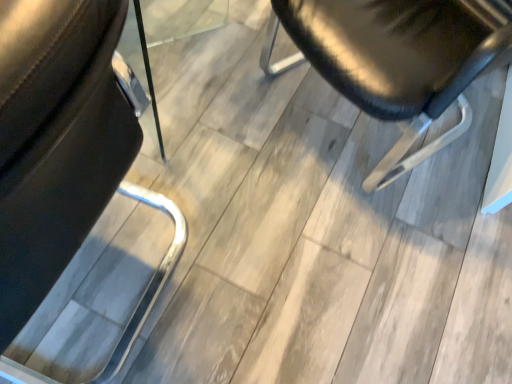
What is the approximate height of black leather chair at left, arranged as the second chair when viewed from the right?

36.14 inches.

Locate an element on the screen. black leather chair at left, arranged as the second chair when viewed from the right is located at coordinates (65, 155).

Describe the element at coordinates (65, 155) in the screenshot. I see `black leather chair at left, arranged as the second chair when viewed from the right` at that location.

What do you see at coordinates (395, 57) in the screenshot?
I see `shiny black chair at center, which appears as the first chair when viewed from the right` at bounding box center [395, 57].

Where is `shiny black chair at center, which appears as the first chair when viewed from the right`? The width and height of the screenshot is (512, 384). shiny black chair at center, which appears as the first chair when viewed from the right is located at coordinates (395, 57).

What is the approximate height of shiny black chair at center, which is counted as the second chair, starting from the left?

The height of shiny black chair at center, which is counted as the second chair, starting from the left, is 31.80 inches.

Where is `black leather chair at left, arranged as the second chair when viewed from the right`? The width and height of the screenshot is (512, 384). black leather chair at left, arranged as the second chair when viewed from the right is located at coordinates 65,155.

Considering the positions of objects shiny black chair at center, which appears as the first chair when viewed from the right, and black leather chair at left, arranged as the second chair when viewed from the right, in the image provided, who is more to the right, shiny black chair at center, which appears as the first chair when viewed from the right, or black leather chair at left, arranged as the second chair when viewed from the right,?

From the viewer's perspective, shiny black chair at center, which appears as the first chair when viewed from the right, appears more on the right side.

Is the depth of shiny black chair at center, which appears as the first chair when viewed from the right, less than that of black leather chair at left, placed as the 1th chair when sorted from left to right?

No, it is not.

Which point is more forward, (377, 109) or (16, 191)?

The point (16, 191) is closer to the camera.

From the image's perspective, is shiny black chair at center, which is counted as the second chair, starting from the left, under black leather chair at left, arranged as the second chair when viewed from the right?

Actually, shiny black chair at center, which is counted as the second chair, starting from the left, appears above black leather chair at left, arranged as the second chair when viewed from the right, in the image.

From a real-world perspective, is shiny black chair at center, which appears as the first chair when viewed from the right, physically above black leather chair at left, placed as the 1th chair when sorted from left to right?

No, from a real-world perspective, shiny black chair at center, which appears as the first chair when viewed from the right, is not on top of black leather chair at left, placed as the 1th chair when sorted from left to right.

Looking at their sizes, would you say shiny black chair at center, which is counted as the second chair, starting from the left, is wider or thinner than black leather chair at left, placed as the 1th chair when sorted from left to right?

shiny black chair at center, which is counted as the second chair, starting from the left, is wider than black leather chair at left, placed as the 1th chair when sorted from left to right.

Considering the sizes of objects shiny black chair at center, which appears as the first chair when viewed from the right, and black leather chair at left, arranged as the second chair when viewed from the right, in the image provided, who is taller, shiny black chair at center, which appears as the first chair when viewed from the right, or black leather chair at left, arranged as the second chair when viewed from the right,?

With more height is black leather chair at left, arranged as the second chair when viewed from the right.

Considering the sizes of objects shiny black chair at center, which is counted as the second chair, starting from the left, and black leather chair at left, arranged as the second chair when viewed from the right, in the image provided, who is bigger, shiny black chair at center, which is counted as the second chair, starting from the left, or black leather chair at left, arranged as the second chair when viewed from the right,?

black leather chair at left, arranged as the second chair when viewed from the right, is bigger.

Would you say shiny black chair at center, which is counted as the second chair, starting from the left, is outside black leather chair at left, arranged as the second chair when viewed from the right?

Yes, shiny black chair at center, which is counted as the second chair, starting from the left, is outside of black leather chair at left, arranged as the second chair when viewed from the right.

Is the surface of shiny black chair at center, which appears as the first chair when viewed from the right, in direct contact with black leather chair at left, placed as the 1th chair when sorted from left to right?

No, shiny black chair at center, which appears as the first chair when viewed from the right, is not beside black leather chair at left, placed as the 1th chair when sorted from left to right.

Is shiny black chair at center, which is counted as the second chair, starting from the left, oriented away from black leather chair at left, arranged as the second chair when viewed from the right?

No, black leather chair at left, arranged as the second chair when viewed from the right, is not at the back of shiny black chair at center, which is counted as the second chair, starting from the left.

Can you tell me how much shiny black chair at center, which is counted as the second chair, starting from the left, and black leather chair at left, placed as the 1th chair when sorted from left to right, differ in facing direction?

The angle between the facing direction of shiny black chair at center, which is counted as the second chair, starting from the left, and the facing direction of black leather chair at left, placed as the 1th chair when sorted from left to right, is 58.4 degrees.

Where is `chair that is behind the black leather chair at left, placed as the 1th chair when sorted from left to right`? chair that is behind the black leather chair at left, placed as the 1th chair when sorted from left to right is located at coordinates (395, 57).

Which object is positioned more to the left, black leather chair at left, placed as the 1th chair when sorted from left to right, or shiny black chair at center, which appears as the first chair when viewed from the right?

Positioned to the left is black leather chair at left, placed as the 1th chair when sorted from left to right.

Considering the positions of objects black leather chair at left, placed as the 1th chair when sorted from left to right, and shiny black chair at center, which appears as the first chair when viewed from the right, in the image provided, who is behind, black leather chair at left, placed as the 1th chair when sorted from left to right, or shiny black chair at center, which appears as the first chair when viewed from the right,?

shiny black chair at center, which appears as the first chair when viewed from the right, is further away from the camera.

Does point (0, 358) appear closer or farther from the camera than point (426, 58)?

Point (0, 358) is farther from the camera than point (426, 58).

From the image's perspective, does black leather chair at left, placed as the 1th chair when sorted from left to right, appear higher than shiny black chair at center, which is counted as the second chair, starting from the left?

Actually, black leather chair at left, placed as the 1th chair when sorted from left to right, appears below shiny black chair at center, which is counted as the second chair, starting from the left, in the image.

From a real-world perspective, relative to shiny black chair at center, which appears as the first chair when viewed from the right, is black leather chair at left, arranged as the second chair when viewed from the right, vertically above or below?

black leather chair at left, arranged as the second chair when viewed from the right, is situated higher than shiny black chair at center, which appears as the first chair when viewed from the right, in the real world.

Which of these two, black leather chair at left, arranged as the second chair when viewed from the right, or shiny black chair at center, which appears as the first chair when viewed from the right, is thinner?

black leather chair at left, arranged as the second chair when viewed from the right.

Is black leather chair at left, arranged as the second chair when viewed from the right, shorter than shiny black chair at center, which is counted as the second chair, starting from the left?

Incorrect, the height of black leather chair at left, arranged as the second chair when viewed from the right, does not fall short of that of shiny black chair at center, which is counted as the second chair, starting from the left.

Considering the relative sizes of black leather chair at left, arranged as the second chair when viewed from the right, and shiny black chair at center, which is counted as the second chair, starting from the left, in the image provided, is black leather chair at left, arranged as the second chair when viewed from the right, smaller than shiny black chair at center, which is counted as the second chair, starting from the left,?

Actually, black leather chair at left, arranged as the second chair when viewed from the right, might be larger than shiny black chair at center, which is counted as the second chair, starting from the left.

Can we say black leather chair at left, placed as the 1th chair when sorted from left to right, lies outside shiny black chair at center, which is counted as the second chair, starting from the left?

Indeed, black leather chair at left, placed as the 1th chair when sorted from left to right, is completely outside shiny black chair at center, which is counted as the second chair, starting from the left.

Would you say black leather chair at left, placed as the 1th chair when sorted from left to right, is a long distance from shiny black chair at center, which appears as the first chair when viewed from the right?

No.

Is black leather chair at left, arranged as the second chair when viewed from the right, aimed at shiny black chair at center, which is counted as the second chair, starting from the left?

No, black leather chair at left, arranged as the second chair when viewed from the right, is not oriented towards shiny black chair at center, which is counted as the second chair, starting from the left.

How far apart are black leather chair at left, arranged as the second chair when viewed from the right, and shiny black chair at center, which is counted as the second chair, starting from the left?

black leather chair at left, arranged as the second chair when viewed from the right, is 25.80 inches away from shiny black chair at center, which is counted as the second chair, starting from the left.

In the image, there is a shiny black chair at center, which is counted as the second chair, starting from the left. Where is `chair below it (from the image's perspective)`? Image resolution: width=512 pixels, height=384 pixels. chair below it (from the image's perspective) is located at coordinates [x=65, y=155].

The height and width of the screenshot is (384, 512). I want to click on chair behind the black leather chair at left, arranged as the second chair when viewed from the right, so click(x=395, y=57).

Where is `chair that is below the shiny black chair at center, which is counted as the second chair, starting from the left (from the image's perspective)`? chair that is below the shiny black chair at center, which is counted as the second chair, starting from the left (from the image's perspective) is located at coordinates (65, 155).